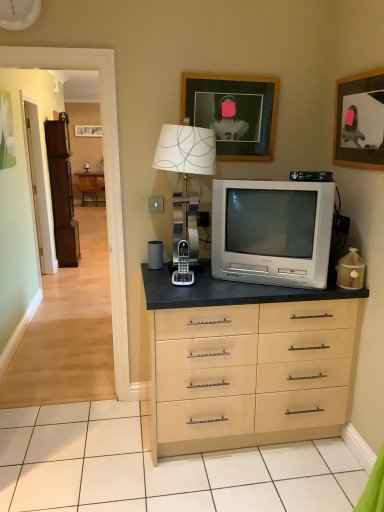
Find the location of `vacant area on top of wooden picture frame at upper center, placed as the 1th picture frame when sorted from left to right (from a real-world perspective)`. vacant area on top of wooden picture frame at upper center, placed as the 1th picture frame when sorted from left to right (from a real-world perspective) is located at coordinates (239, 67).